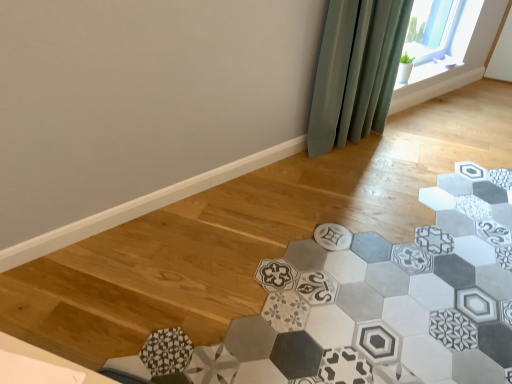
Question: From a real-world perspective, relative to green fabric curtain at upper right, is patterned ceramic tile at center vertically above or below?

Choices:
 (A) below
 (B) above

Answer: (A)

Question: Do you think patterned ceramic tile at center is within green fabric curtain at upper right, or outside of it?

Choices:
 (A) inside
 (B) outside

Answer: (B)

Question: Considering the positions of patterned ceramic tile at center and green fabric curtain at upper right in the image, is patterned ceramic tile at center wider or thinner than green fabric curtain at upper right?

Choices:
 (A) thin
 (B) wide

Answer: (B)

Question: In terms of width, does green fabric curtain at upper right look wider or thinner when compared to patterned ceramic tile at center?

Choices:
 (A) thin
 (B) wide

Answer: (A)

Question: Considering the relative positions of green fabric curtain at upper right and patterned ceramic tile at center in the image provided, is green fabric curtain at upper right to the left or to the right of patterned ceramic tile at center?

Choices:
 (A) left
 (B) right

Answer: (B)

Question: Considering their positions, is green fabric curtain at upper right located in front of or behind patterned ceramic tile at center?

Choices:
 (A) front
 (B) behind

Answer: (B)

Question: Is green fabric curtain at upper right inside or outside of patterned ceramic tile at center?

Choices:
 (A) outside
 (B) inside

Answer: (A)